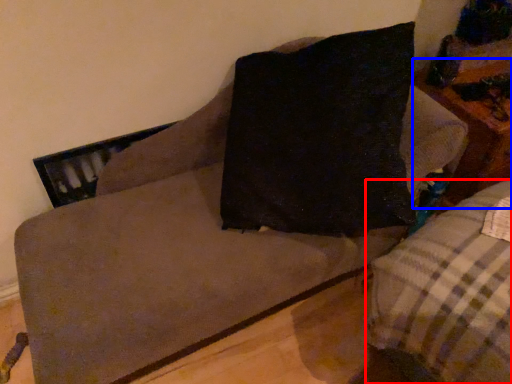
Question: Among these objects, which one is nearest to the camera, studio couch (highlighted by a red box) or table (highlighted by a blue box)?

Choices:
 (A) studio couch
 (B) table

Answer: (A)